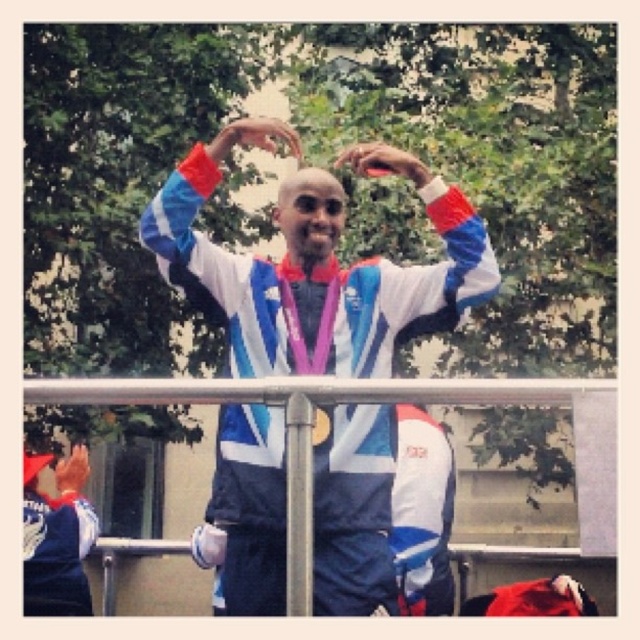
Can you confirm if metallic silver rail at center is positioned to the left of blue fabric jacket at left?

Incorrect, metallic silver rail at center is not on the left side of blue fabric jacket at left.

Who is positioned more to the right, metallic silver rail at center or blue fabric jacket at left?

metallic silver rail at center is more to the right.

Is point (232, 394) closer to viewer compared to point (54, 541)?

Yes, point (232, 394) is in front of point (54, 541).

Locate an element on the screen. This screenshot has width=640, height=640. metallic silver rail at center is located at coordinates (387, 400).

The height and width of the screenshot is (640, 640). What do you see at coordinates (314, 282) in the screenshot? I see `blue/white/red fabric at center` at bounding box center [314, 282].

Between blue/white/red fabric at center and blue fabric jacket at left, which one is positioned higher?

blue/white/red fabric at center is above.

Who is more forward, (x=269, y=296) or (x=67, y=540)?

Positioned in front is point (x=67, y=540).

What are the coordinates of `blue/white/red fabric at center` in the screenshot? It's located at (314, 282).

Can you confirm if blue/white/red fabric at center is shorter than matte black hand at lower left?

No.

Between blue/white/red fabric at center and matte black hand at lower left, which one has less height?

With less height is matte black hand at lower left.

Where is `blue/white/red fabric at center`? This screenshot has width=640, height=640. blue/white/red fabric at center is located at coordinates (314, 282).